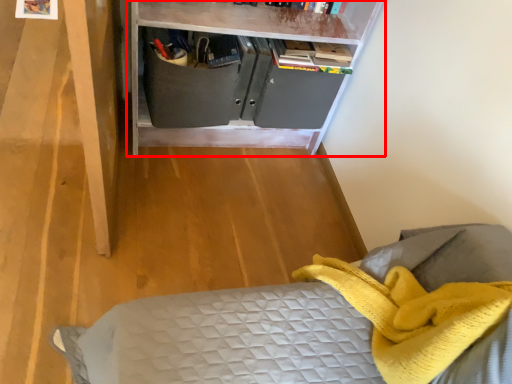
Question: In this image, where is shelf (annotated by the red box) located relative to drawer?

Choices:
 (A) right
 (B) left

Answer: (A)